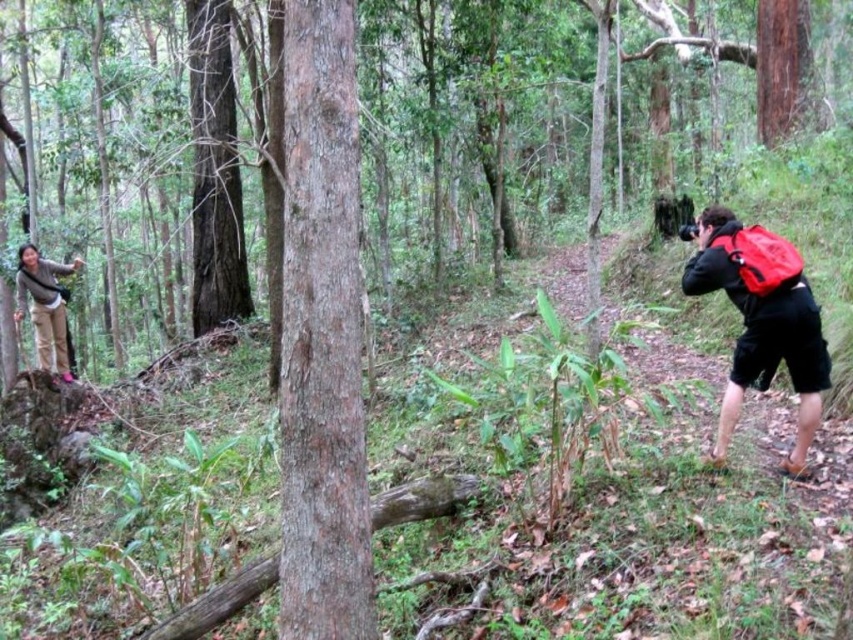
You are standing on the dirt path in the forest and see the smooth brown tree trunk at center and the matte beige pants at left. Which object is nearer to you?

The smooth brown tree trunk at center is closer to the viewer than the matte beige pants at left, so the smooth brown tree trunk at center is nearer to you.

Consider the image. You are a hiker carrying a red fabric backpack at right and need to pass through a narrow gap between two trees. The gap is just wide enough for the smooth brown tree trunk at center. Can you fit through the gap while carrying your backpack?

The smooth brown tree trunk at center is narrower than the red fabric backpack at right. Since the gap is only wide enough for the tree trunk, the backpack is wider and won